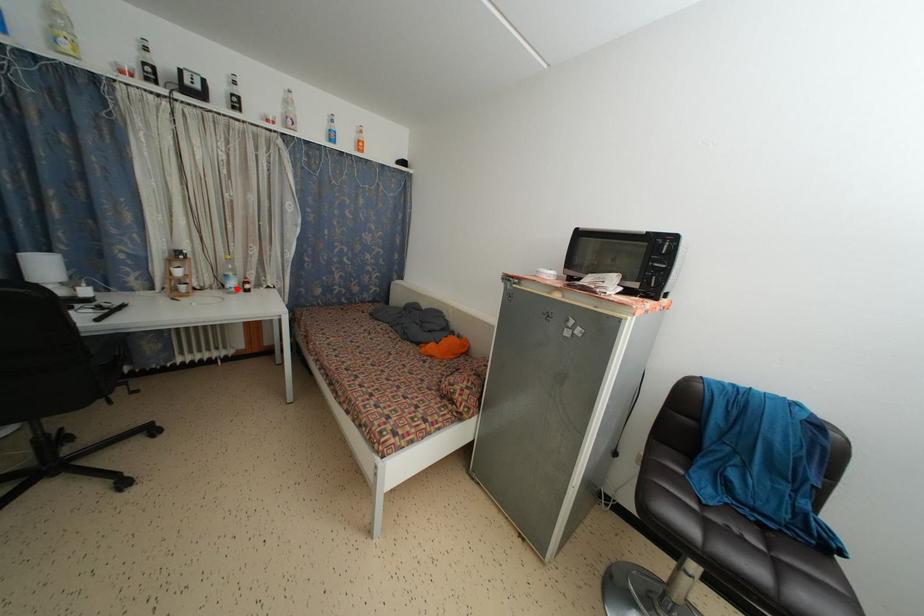
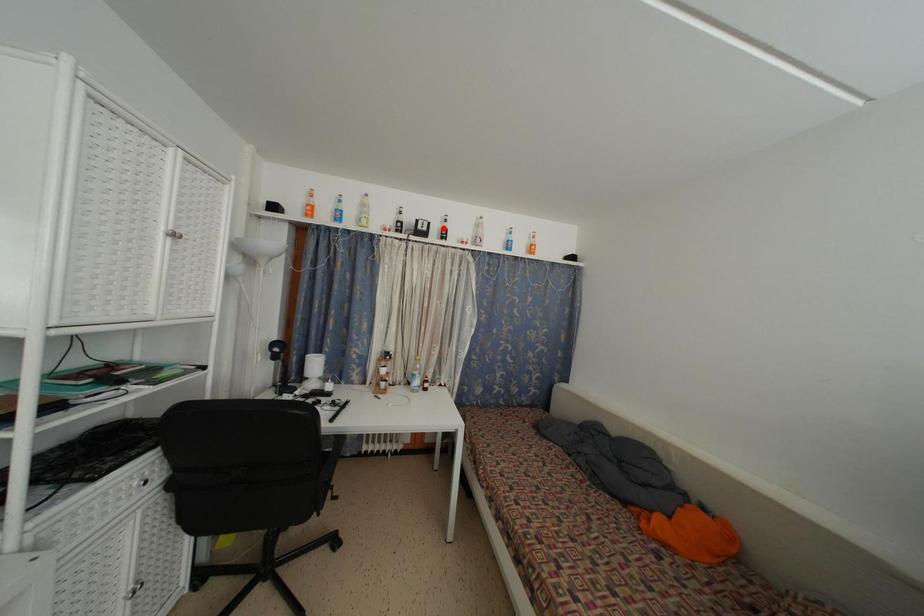
I am providing you with two images of the same scene from different viewpoints. A red point is marked on the first image and another point is marked on the second image. Do the highlighted points in image1 and image2 indicate the same real-world spot?

No